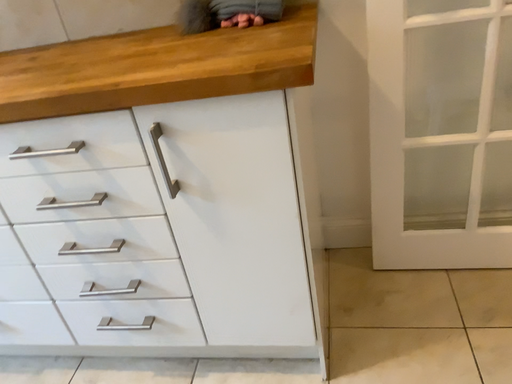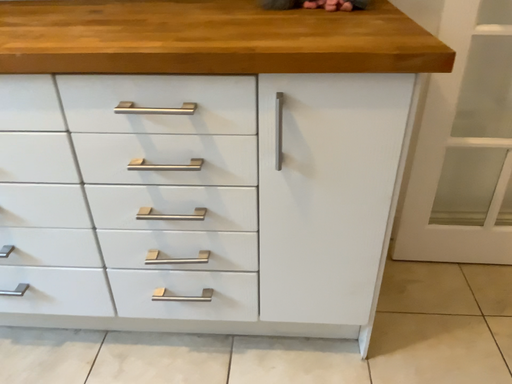
Question: How did the camera likely rotate when shooting the video?

Choices:
 (A) rotated left
 (B) rotated right

Answer: (B)